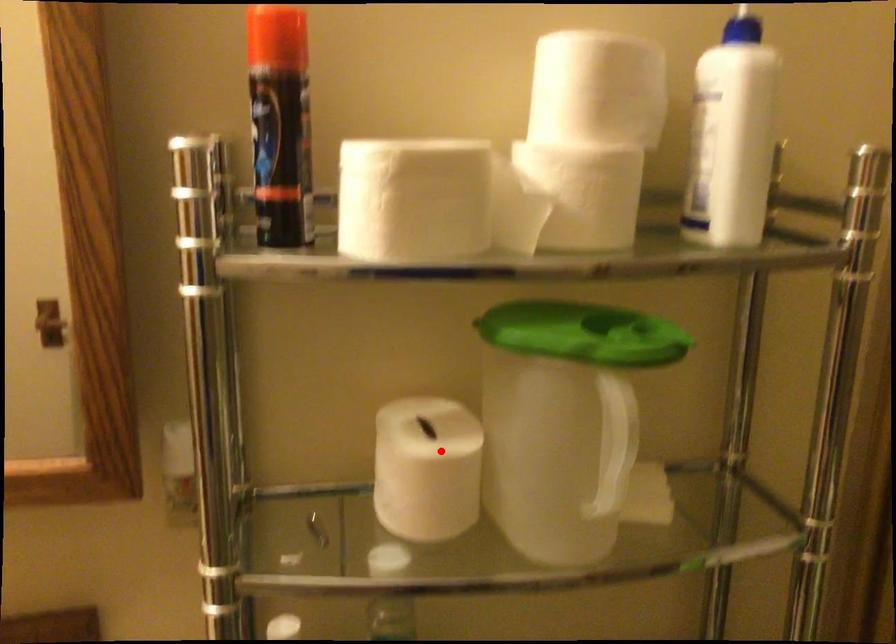
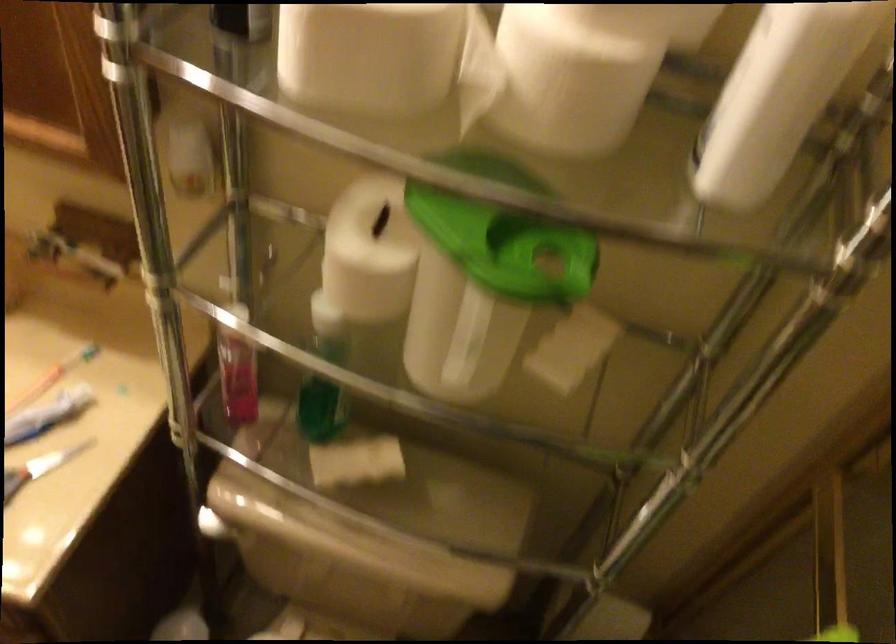
Find the pixel in the second image that matches the highlighted location in the first image.

(369, 252)